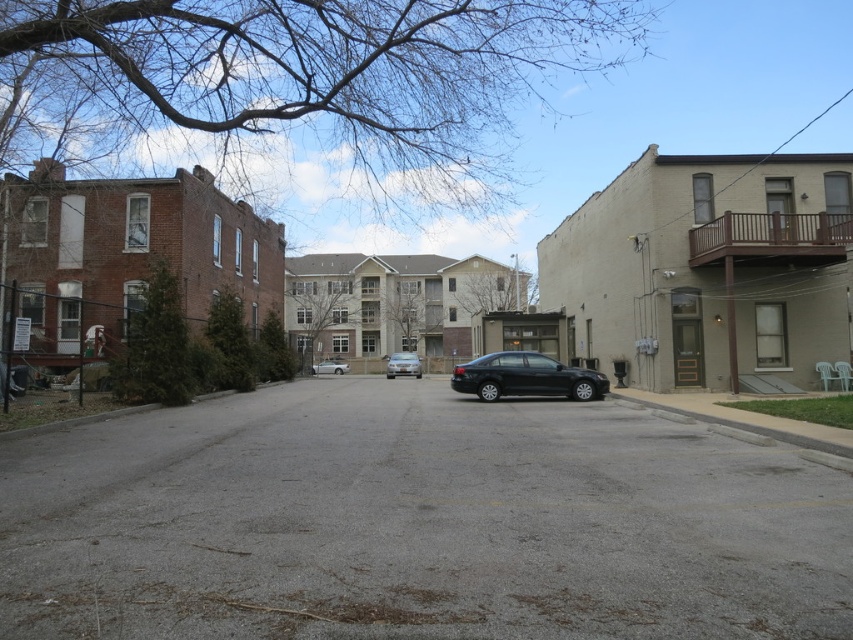
Between black matte sedan at center and silver metallic car at center, which one is positioned higher?

Positioned higher is black matte sedan at center.

Locate an element on the screen. The image size is (853, 640). black matte sedan at center is located at coordinates (526, 378).

Image resolution: width=853 pixels, height=640 pixels. What are the coordinates of `black matte sedan at center` in the screenshot? It's located at (526, 378).

Does gray asphalt road at center appear on the right side of black matte sedan at center?

No, gray asphalt road at center is not to the right of black matte sedan at center.

Is gray asphalt road at center below black matte sedan at center?

Correct, gray asphalt road at center is located below black matte sedan at center.

Is point (302, 454) less distant than point (506, 384)?

Yes, point (302, 454) is closer to viewer.

Locate an element on the screen. Image resolution: width=853 pixels, height=640 pixels. gray asphalt road at center is located at coordinates (416, 524).

What do you see at coordinates (416, 524) in the screenshot? Image resolution: width=853 pixels, height=640 pixels. I see `gray asphalt road at center` at bounding box center [416, 524].

Between gray asphalt road at center and satin silver sedan at center, which one appears on the left side from the viewer's perspective?

From the viewer's perspective, satin silver sedan at center appears more on the left side.

Is point (309, 608) positioned in front of point (404, 374)?

Yes.

Locate an element on the screen. gray asphalt road at center is located at coordinates (416, 524).